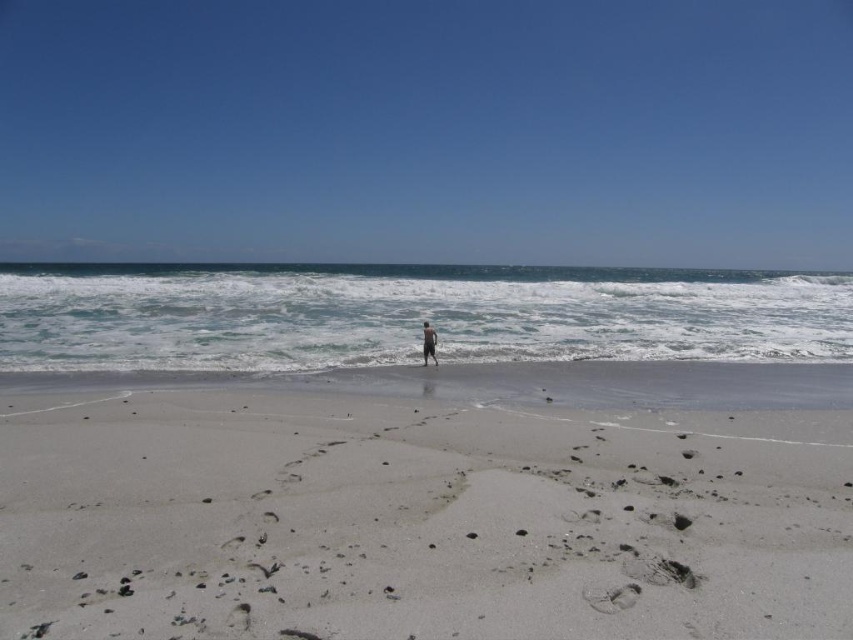
You are standing on the white sandy beach at center and looking towards the ocean. Can you see the tan skin person at center in front of you?

The white sandy beach at center is in front of the tan skin person at center, so the tan skin person at center is behind you and you cannot see them.